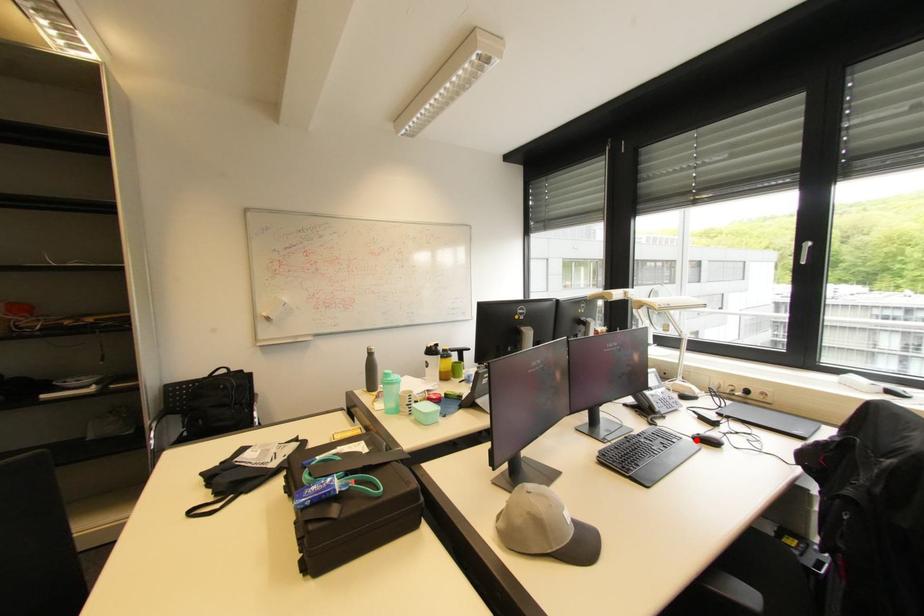
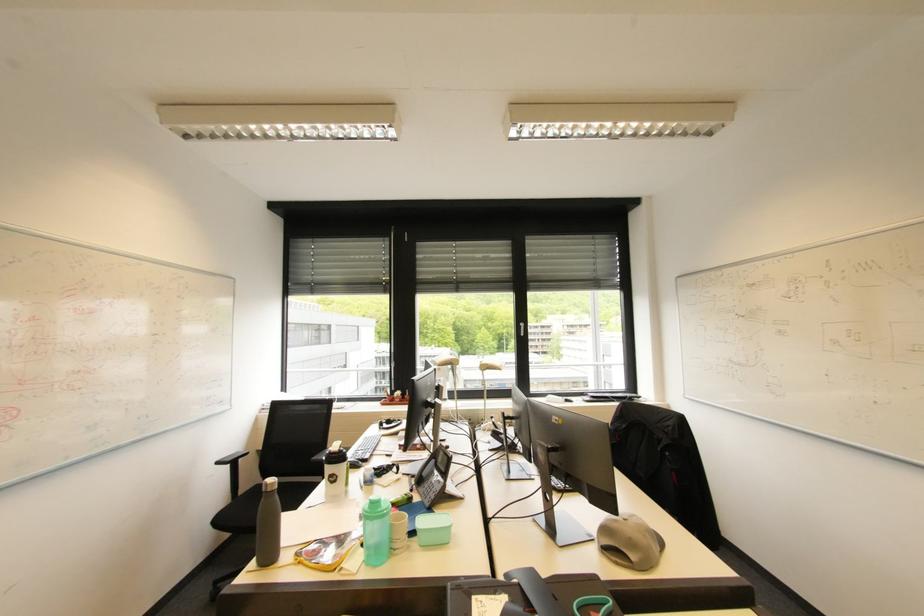
Question: I am providing you with two images of the same scene from different viewpoints. A red point is marked on the first image. Can you still see the location of the red point in image 2?

Choices:
 (A) Yes
 (B) No

Answer: (B)